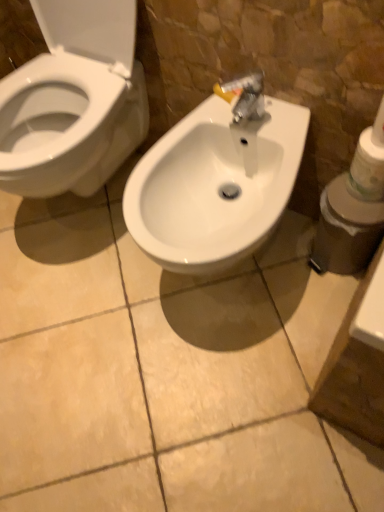
Question: Considering their positions, is white plastic container at right located in front of or behind white glossy sink at center?

Choices:
 (A) behind
 (B) front

Answer: (A)

Question: In terms of height, does white plastic container at right look taller or shorter compared to white glossy sink at center?

Choices:
 (A) tall
 (B) short

Answer: (B)

Question: Estimate the real-world distances between objects in this image. Which object is closer to the white plastic container at right?

Choices:
 (A) white glossy sink at center
 (B) white matte toilet paper at right

Answer: (B)

Question: Considering the real-world distances, which object is closest to the white plastic container at right?

Choices:
 (A) white matte toilet paper at right
 (B) white glossy sink at center

Answer: (A)